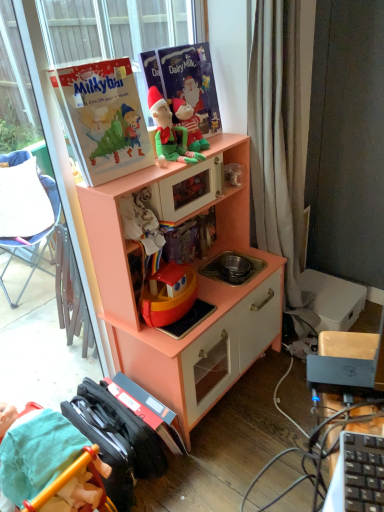
I want to click on free spot in front of matte paperboard book at upper left, the 2th paperback book from the right, so click(117, 180).